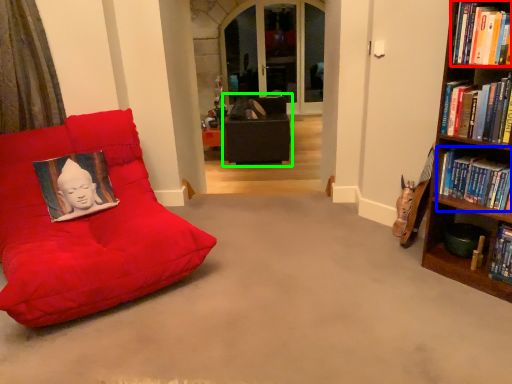
Question: Considering the real-world distances, which object is farthest from book (highlighted by a red box)? book (highlighted by a blue box) or bean bag chair (highlighted by a green box)?

Choices:
 (A) book
 (B) bean bag chair

Answer: (B)